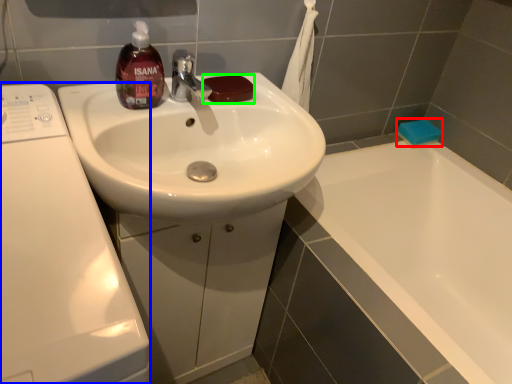
Question: Which is farther away from soap (highlighted by a red box)? washing machine (highlighted by a blue box) or soap (highlighted by a green box)?

Choices:
 (A) washing machine
 (B) soap

Answer: (A)